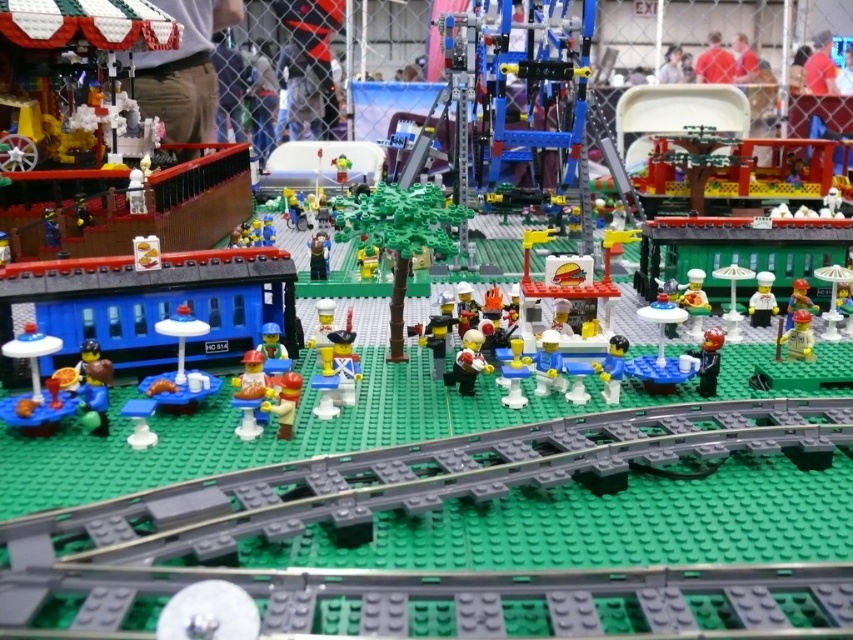
Question: Estimate the real-world distances between objects in this image. Which object is closer to the smooth plastic minifigure at center?

Choices:
 (A) smooth brown minifigure at center
 (B) translucent yellow minifigure at center
 (C) white glossy chef hat at center
 (D) yellow matte cupcake at center

Answer: (B)

Question: Which of the following is the closest to the observer?

Choices:
 (A) (317, 275)
 (B) (260, 326)
 (C) (374, 250)

Answer: (B)

Question: Does red plastic figure at right have a greater width compared to yellow plastic minifigure at center?

Choices:
 (A) no
 (B) yes

Answer: (B)

Question: Which point is farther to the camera?

Choices:
 (A) smooth brown minifigure at center
 (B) red plastic figure at right
 (C) shiny silver helmet at center
 (D) yellow matte cupcake at center

Answer: (A)

Question: Is light blue plastic figure at center to the right of white glossy chef hat at center from the viewer's perspective?

Choices:
 (A) no
 (B) yes

Answer: (A)

Question: Does yellow matte minifigure at right have a larger size compared to smooth plastic minifigure at center?

Choices:
 (A) yes
 (B) no

Answer: (A)